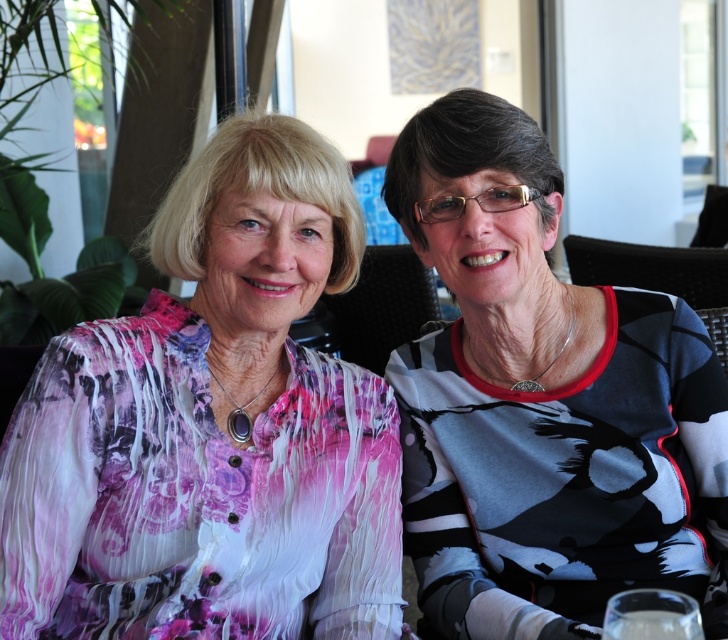
Which is more to the right, pink floral blouse at left or black and white printed shirt at right?

black and white printed shirt at right

Is the position of pink floral blouse at left less distant than that of black and white printed shirt at right?

That is True.

This screenshot has width=728, height=640. I want to click on pink floral blouse at left, so click(x=213, y=428).